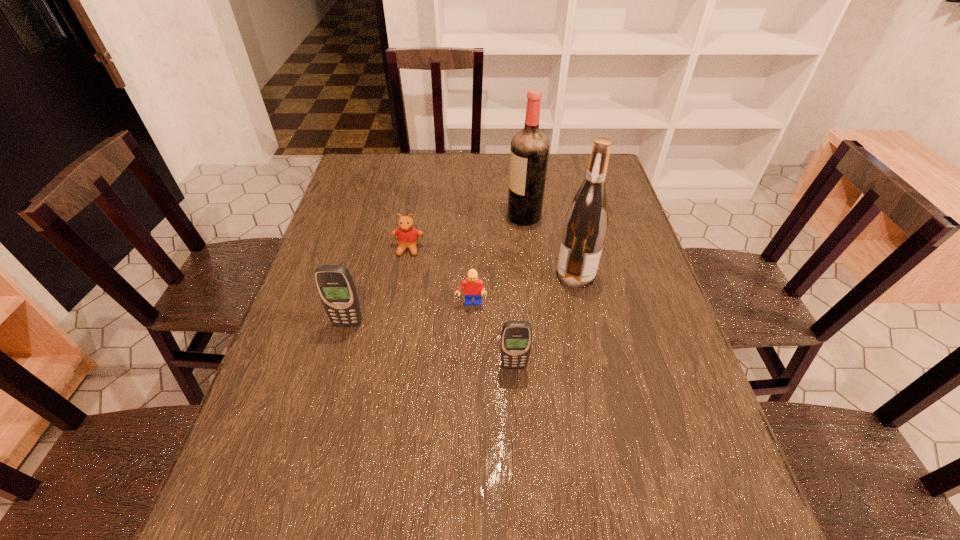
Where is `the fifth object from right to left`? the fifth object from right to left is located at coordinates (407, 236).

Where is `vacant space located 0.170m on the screen of the leftmost object`? The width and height of the screenshot is (960, 540). vacant space located 0.170m on the screen of the leftmost object is located at coordinates (330, 389).

The width and height of the screenshot is (960, 540). In order to click on free location located 0.140m on the screen of the shorter cellular telephone in this screenshot , I will do `click(517, 429)`.

Image resolution: width=960 pixels, height=540 pixels. What are the coordinates of `free space located on the right of the fourth nearest object` in the screenshot? It's located at (636, 274).

The width and height of the screenshot is (960, 540). Identify the location of free space located on the front-facing side of the farthest object. (426, 217).

The height and width of the screenshot is (540, 960). In order to click on free space located 0.050m on the front-facing side of the farthest object in this screenshot , I will do `click(491, 217)`.

Where is `free spot located 0.100m on the front-facing side of the farthest object`? free spot located 0.100m on the front-facing side of the farthest object is located at coordinates (475, 217).

At what (x,y) coordinates should I click in order to perform the action: click on free region located on the front-facing side of the fourth object from right to left. Please return your answer as a coordinate pair (x, y). Looking at the image, I should click on (470, 339).

Where is `free point located 0.220m on the front-facing side of the fifth nearest object`? The width and height of the screenshot is (960, 540). free point located 0.220m on the front-facing side of the fifth nearest object is located at coordinates (396, 318).

This screenshot has width=960, height=540. In order to click on object present at the left edge in this screenshot , I will do [334, 283].